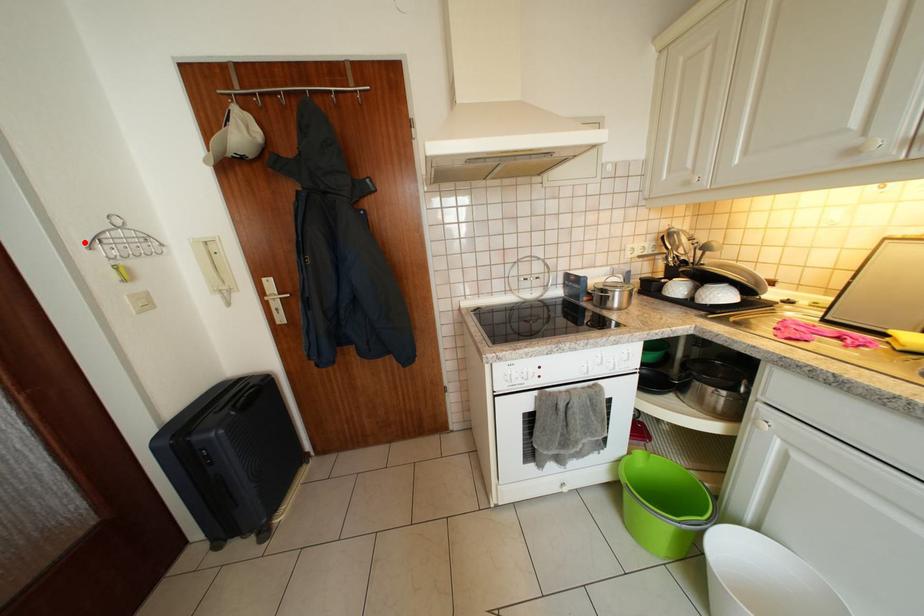
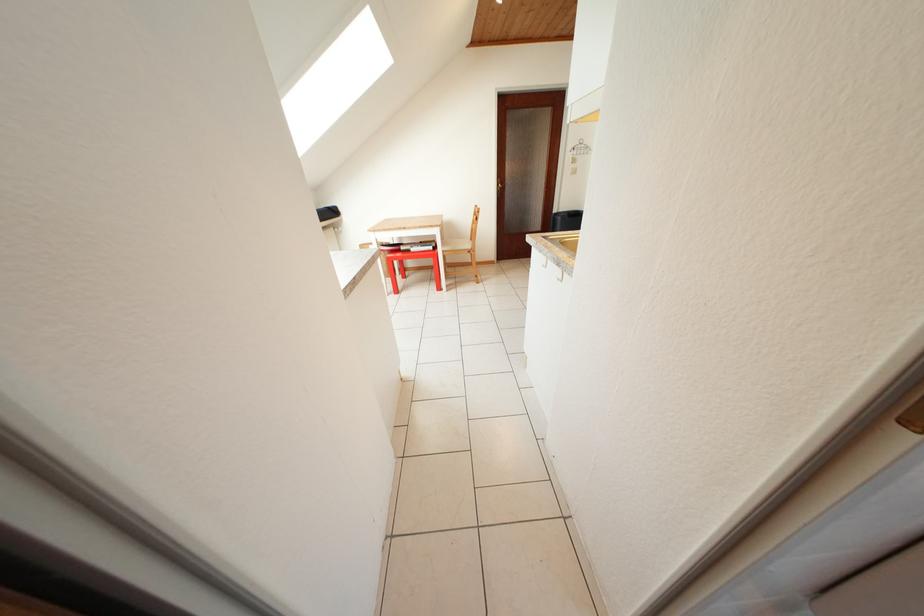
Question: I am providing you with two images of the same scene from different viewpoints. In image1, a red point is highlighted. Considering the same 3D point in image2, which of the following is correct?

Choices:
 (A) It is closer
 (B) It is farther

Answer: (A)